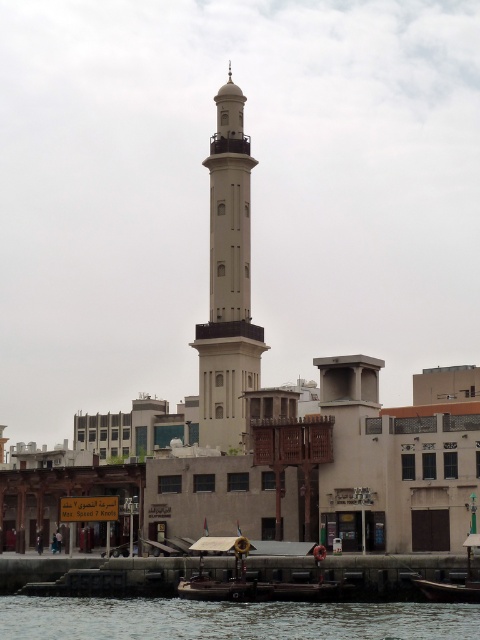
You are a photographer planning to capture the minaret and its surroundings. You notice the dark blue water at lower center and the wooden boat at lower right in your frame. Which object occupies a larger area in the image?

The dark blue water at lower center occupies a larger area in the image because its width is greater than that of the wooden boat at lower right.

Looking at this image, you are standing in the waterfront area looking at the minaret and the surrounding buildings. There are two points marked on a map of the area. One is at point coordinates point (217, 296) and the other at point (460, 596). Which point is closer to you?

Point (217, 296) is closer to you because it is further to the viewer than point (460, 596).

You are a tourist standing at the waterfront and see the white smooth minaret at center and the dark blue water at lower center. Which one appears taller from your perspective?

The white smooth minaret at center appears taller than the dark blue water at lower center because the dark blue water at lower center has a lesser height compared to the white smooth minaret at center.